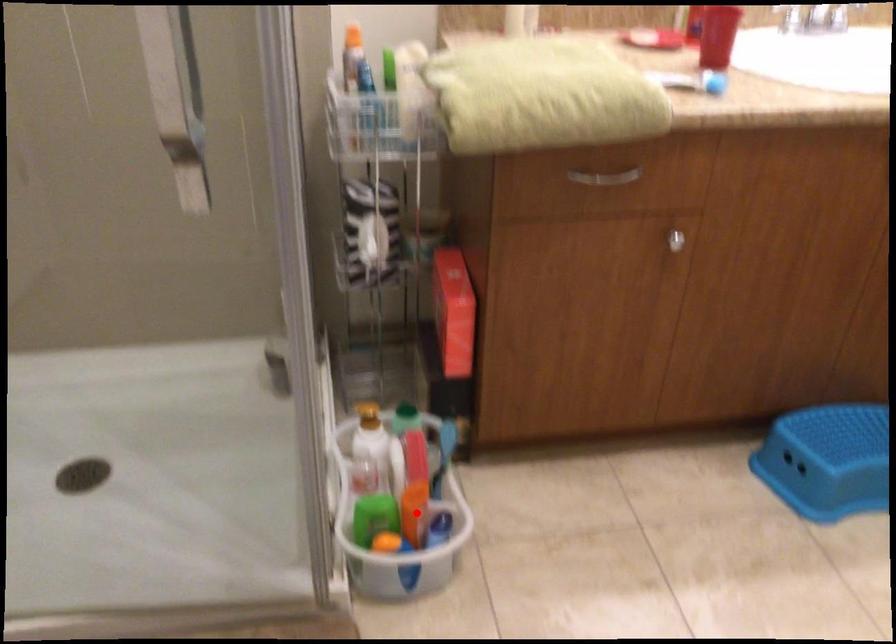
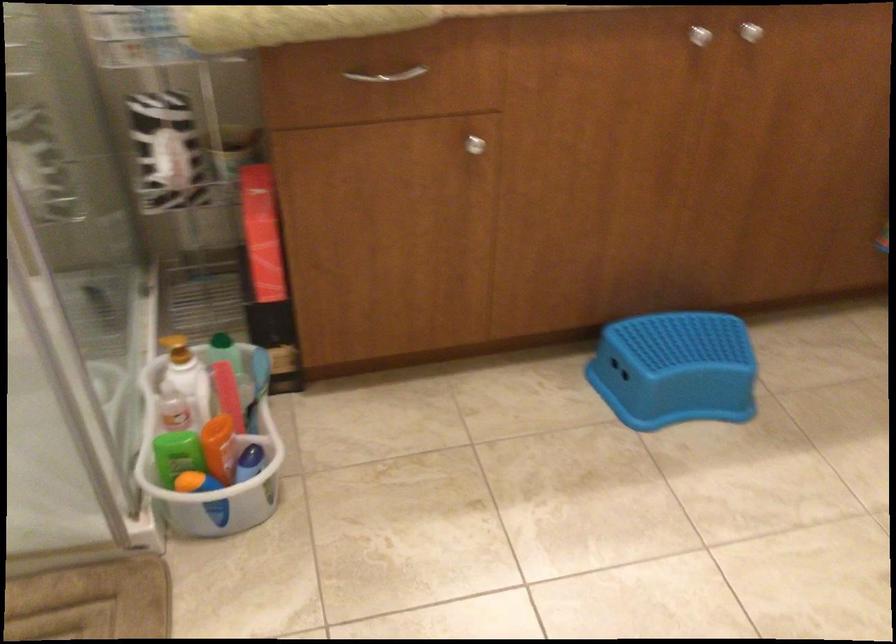
In the second image, find the point that corresponds to the highlighted location in the first image.

(220, 448)